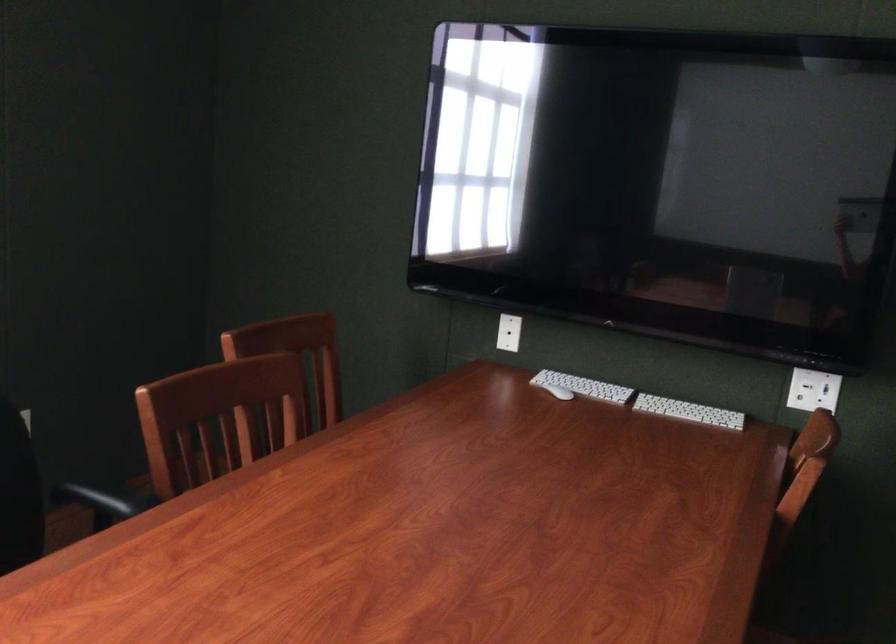
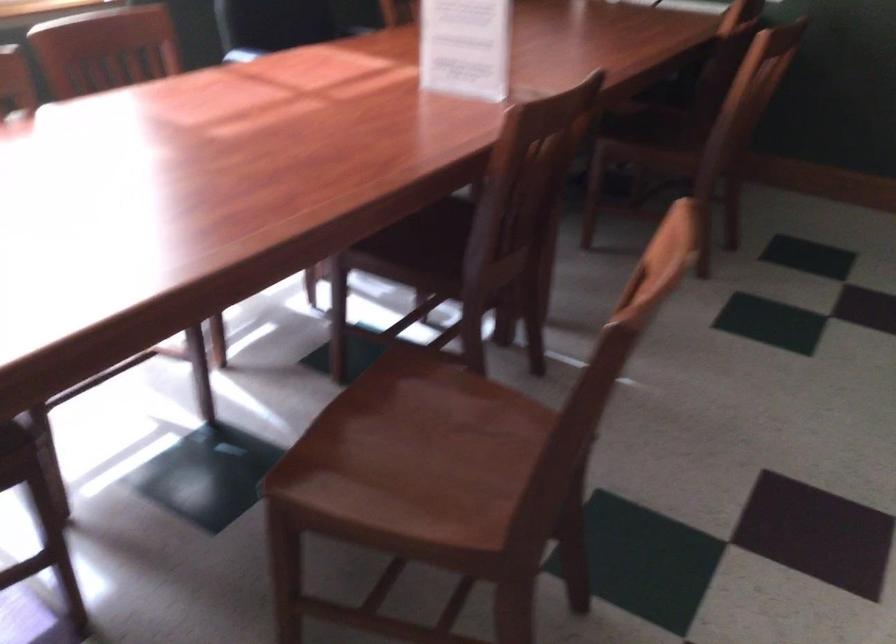
Question: Which direction would the cameraman need to move to produce the second image? Reply with the corresponding letter.

Choices:
 (A) Left
 (B) Right
 (C) Forward
 (D) Backward

Answer: (D)